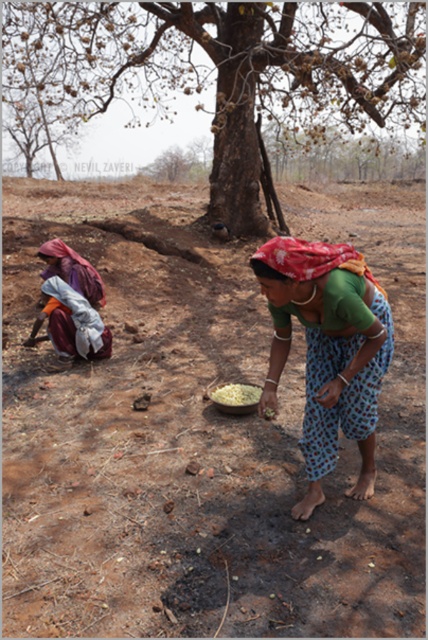
Question: Does brown rough tree at center have a larger size compared to green fabric cloth at center?

Choices:
 (A) no
 (B) yes

Answer: (B)

Question: Can you confirm if brown rough tree at center is bigger than yellow grain at center?

Choices:
 (A) no
 (B) yes

Answer: (B)

Question: Considering the real-world distances, which object is closest to the brown rough tree at center?

Choices:
 (A) yellow grain at center
 (B) brown soil at center
 (C) green fabric cloth at center

Answer: (B)

Question: Does brown rough tree at center appear under yellow grain at center?

Choices:
 (A) yes
 (B) no

Answer: (B)

Question: Which of the following is the closest to the observer?

Choices:
 (A) brown rough tree at center
 (B) green fabric cloth at center
 (C) brown soil at center
 (D) yellow grain at center

Answer: (C)

Question: Estimate the real-world distances between objects in this image. Which object is closer to the green fabric cloth at center?

Choices:
 (A) brown soil at center
 (B) yellow grain at center

Answer: (B)